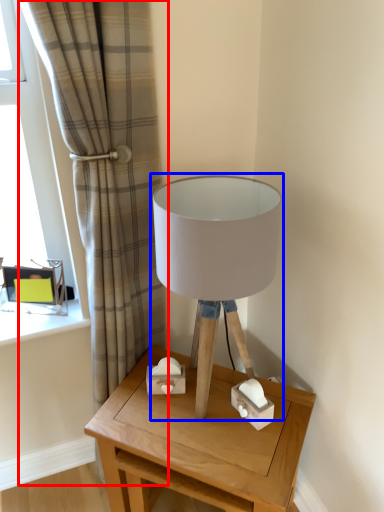
Question: Which object appears farthest to the camera in this image, curtain (highlighted by a red box) or lamp (highlighted by a blue box)?

Choices:
 (A) curtain
 (B) lamp

Answer: (B)